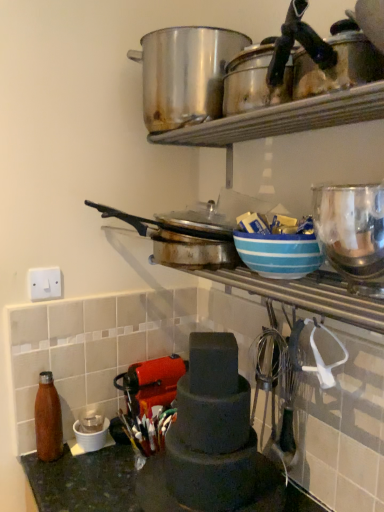
Question: From their relative heights in the image, would you say white plastic switch at upper left is taller or shorter than dark green stone countertop at lower left?

Choices:
 (A) tall
 (B) short

Answer: (B)

Question: In the image, is white plastic switch at upper left positioned in front of or behind dark green stone countertop at lower left?

Choices:
 (A) front
 (B) behind

Answer: (B)

Question: Considering the real-world distances, which object is farthest from the matte black tiered cake stand at center, the 1th appliance in the back-to-front sequence?

Choices:
 (A) stainless steel pot at upper center
 (B) matte brown bottle at lower left
 (C) dark green stone countertop at lower left
 (D) shiny metallic bottle at lower left
 (E) blue striped bowl at upper center

Answer: (A)

Question: Estimate the real-world distances between objects in this image. Which object is farther from the blue striped bowl at upper center?

Choices:
 (A) matte brown bottle at lower left
 (B) matte black tiered cake stand at center, the second appliance from the top
 (C) shiny metallic bottle at lower left
 (D) white plastic switch at upper left
 (E) dark green stone countertop at lower left

Answer: (C)